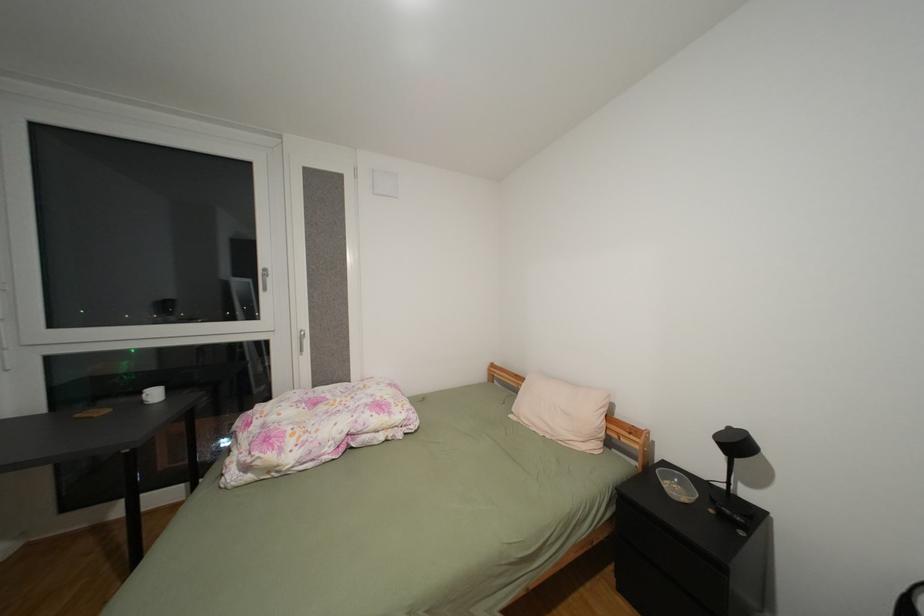
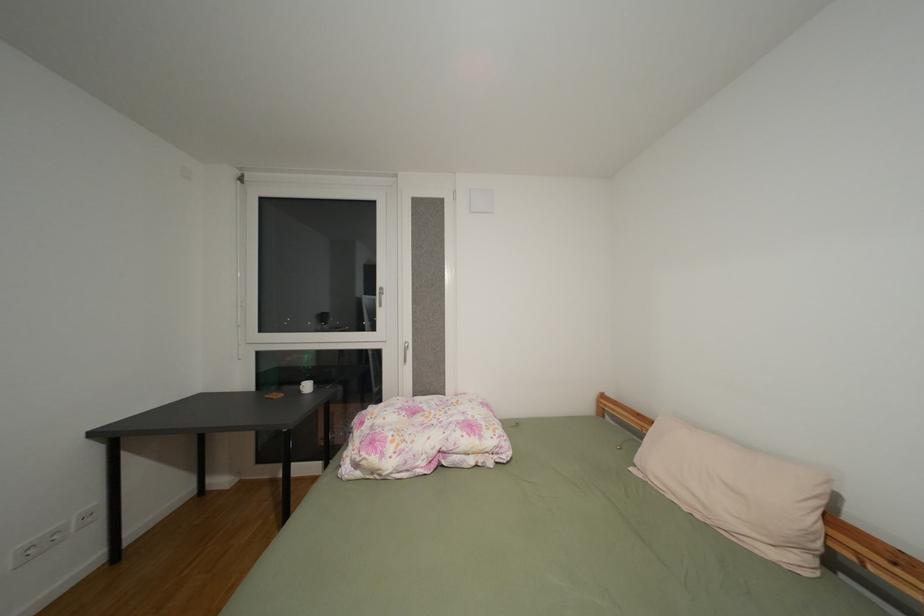
Question: What movement of the cameraman would produce the second image?

Choices:
 (A) Left
 (B) Right
 (C) Forward
 (D) Backward

Answer: (C)